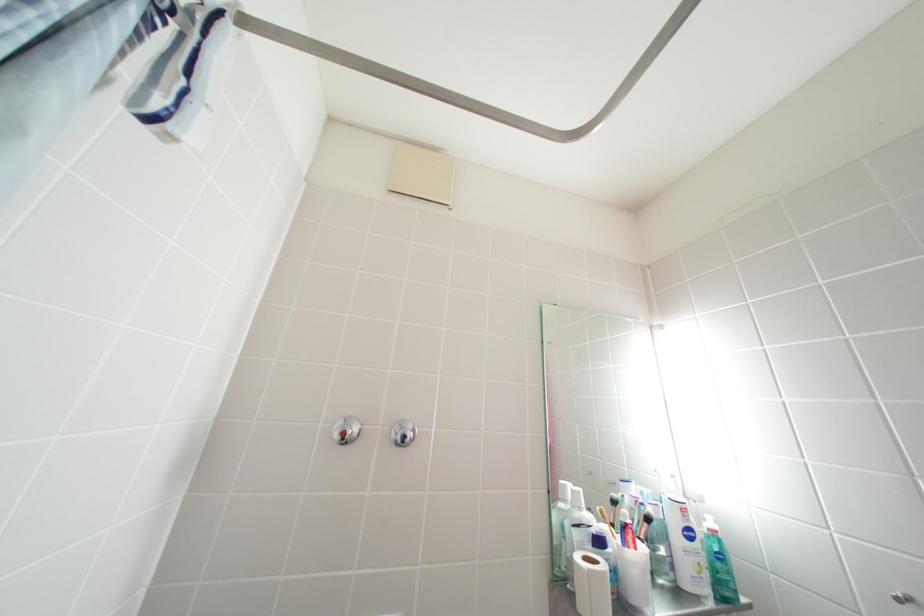
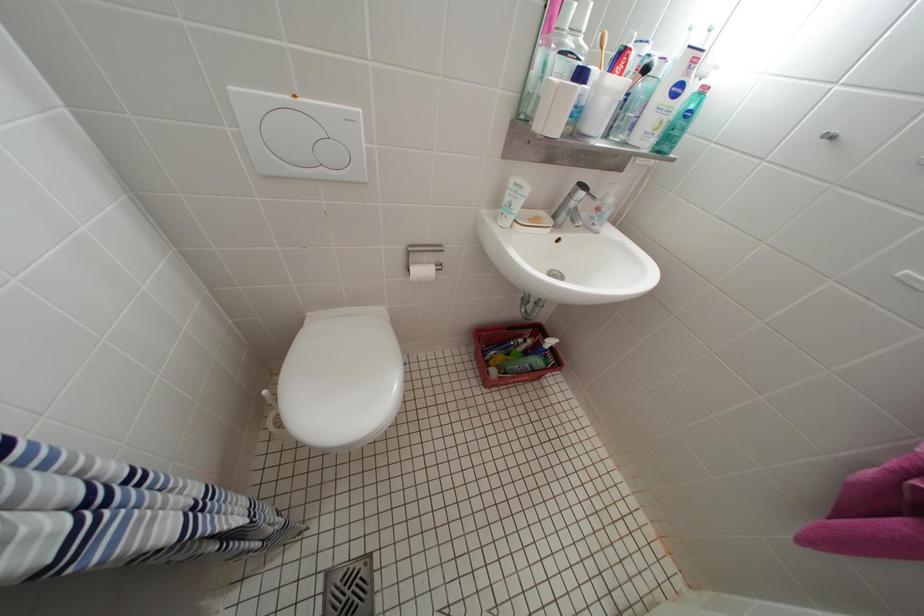
Question: The first image is from the beginning of the video and the second image is from the end. How did the camera likely rotate when shooting the video?

Choices:
 (A) Left
 (B) Right
 (C) Up
 (D) Down

Answer: (D)